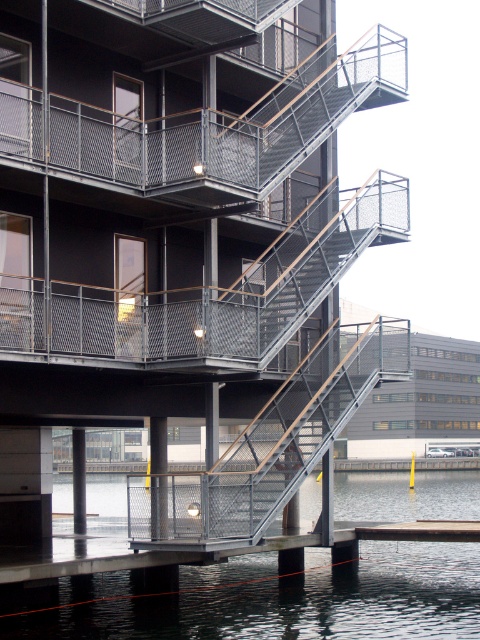
You are a drone operator trying to capture a photo of the black mesh balcony at upper center. You need to ensure the metallic gray water at lower center doesn t block the view. Based on the scene description, can you position the drone so that the balcony is visible without the water obstructing it?

The metallic gray water at lower center is bigger than the black mesh balcony at upper center, so positioning the drone above the water level might allow the balcony to be seen without obstruction.

You are standing at the entrance of the building and want to take a photo of the metallic gray water at lower center. According to the coordinates provided, where should you position yourself to capture it in the frame?

To capture the metallic gray water at lower center in your photo, position yourself at point 0.938 on the x and 0.585 on the y coordinates.